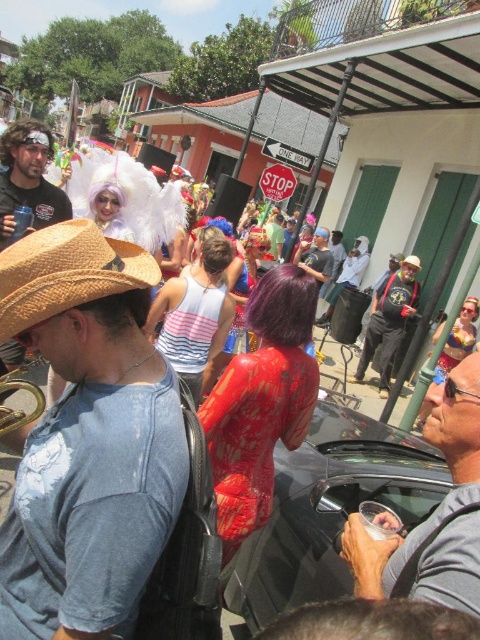
Question: Is straw textured cowboy hat at left thinner than red plastic stop sign at center?

Choices:
 (A) no
 (B) yes

Answer: (B)

Question: Which object is closer to the camera taking this photo?

Choices:
 (A) matte black sunglasses at center
 (B) shiny black car at center
 (C) brown straw hat at center

Answer: (A)

Question: Can you confirm if matte black sunglasses at center is thinner than straw hat at center?

Choices:
 (A) no
 (B) yes

Answer: (B)

Question: Which object appears closest to the camera in this image?

Choices:
 (A) red plastic stop sign at center
 (B) white cotton shirt at center
 (C) shiny black car at center
 (D) matte red shirt at center

Answer: (C)

Question: Which point is closer to the camera taking this photo?

Choices:
 (A) (405, 260)
 (B) (350, 278)
 (C) (39, 260)

Answer: (C)

Question: Does straw textured cowboy hat at left appear over straw hat at center?

Choices:
 (A) no
 (B) yes

Answer: (A)